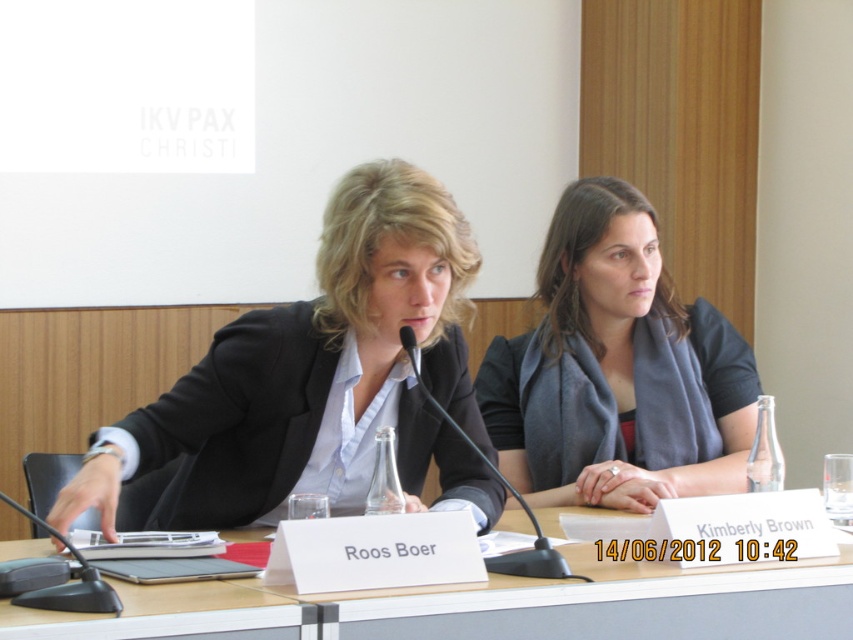
Question: Which of these objects is positioned farthest from the matte gray scarf at center?

Choices:
 (A) matte black blazer at center
 (B) black plastic microphone at lower left
 (C) transparent glass table at center
 (D) black plastic microphone at center

Answer: (B)

Question: Is matte black blazer at center wider than black plastic microphone at lower left?

Choices:
 (A) no
 (B) yes

Answer: (B)

Question: Does matte black blazer at center have a smaller size compared to black plastic microphone at center?

Choices:
 (A) yes
 (B) no

Answer: (B)

Question: Which object is farther from the camera taking this photo?

Choices:
 (A) matte gray scarf at center
 (B) black plastic microphone at lower left

Answer: (A)

Question: Does matte black blazer at center appear over black plastic microphone at center?

Choices:
 (A) yes
 (B) no

Answer: (A)

Question: Considering the real-world distances, which object is closest to the black plastic microphone at lower left?

Choices:
 (A) matte black blazer at center
 (B) matte gray scarf at center
 (C) transparent glass table at center
 (D) black plastic microphone at center

Answer: (C)